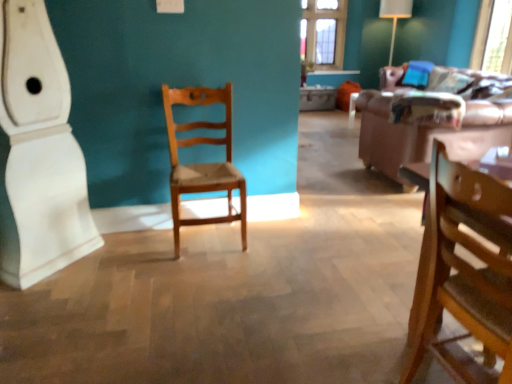
Describe the element at coordinates (203, 163) in the screenshot. The width and height of the screenshot is (512, 384). I see `natural wood chair at center, which is counted as the first chair, starting from the left` at that location.

The height and width of the screenshot is (384, 512). What are the coordinates of `brown leather couch at right` in the screenshot? It's located at (430, 114).

This screenshot has height=384, width=512. Describe the element at coordinates (430, 114) in the screenshot. I see `brown leather couch at right` at that location.

Identify the location of white glossy baseboard at left. (38, 153).

How different are the orientations of natural wood chair at center, marked as the second chair in a front-to-back arrangement, and wooden chair at right, which is the first chair from right to left, in degrees?

The angular difference between natural wood chair at center, marked as the second chair in a front-to-back arrangement, and wooden chair at right, which is the first chair from right to left, is 90.4 degrees.

Is point (177, 129) closer to camera compared to point (477, 270)?

No, (177, 129) is behind (477, 270).

At what (x,y) coordinates should I click in order to perform the action: click on chair that appears on the left of wooden chair at right, positioned as the 1th chair in front-to-back order. Please return your answer as a coordinate pair (x, y). Looking at the image, I should click on (203, 163).

Is natural wood chair at center, which is counted as the first chair, starting from the left, surrounding wooden chair at right, marked as the second chair in a back-to-front arrangement?

No, wooden chair at right, marked as the second chair in a back-to-front arrangement, is not surrounded by natural wood chair at center, which is counted as the first chair, starting from the left.

Would you say white glossy baseboard at left is part of transparent glass window screen at upper right's contents?

Actually, white glossy baseboard at left is outside transparent glass window screen at upper right.

Is transparent glass window screen at upper right oriented away from white glossy baseboard at left?

No, transparent glass window screen at upper right is not facing away from white glossy baseboard at left.

Does transparent glass window screen at upper right have a greater height compared to white glossy baseboard at left?

No.

How many degrees apart are the facing directions of transparent glass window screen at upper right and natural wood chair at center, marked as the second chair in a front-to-back arrangement?

They differ by 91 degrees in their facing directions.

Can you confirm if transparent glass window screen at upper right is bigger than natural wood chair at center, the 1th chair viewed from the back?

Actually, transparent glass window screen at upper right might be smaller than natural wood chair at center, the 1th chair viewed from the back.

From the picture: Is transparent glass window screen at upper right inside the boundaries of natural wood chair at center, the 1th chair viewed from the back, or outside?

transparent glass window screen at upper right is not inside natural wood chair at center, the 1th chair viewed from the back, it's outside.

Considering the points (490, 57) and (230, 206), which point is in front, point (490, 57) or point (230, 206)?

The point (230, 206) is closer.

Which point is more distant from viewer, (175, 181) or (475, 137)?

The point (475, 137) is more distant.

In the scene shown: Who is shorter, natural wood chair at center, the 1th chair viewed from the back, or brown leather couch at right?

With less height is brown leather couch at right.

Is natural wood chair at center, marked as the second chair in a front-to-back arrangement, oriented away from brown leather couch at right?

No, brown leather couch at right is not at the back of natural wood chair at center, marked as the second chair in a front-to-back arrangement.

Considering the sizes of objects natural wood chair at center, which is the 2th chair in right-to-left order, and brown leather couch at right in the image provided, who is bigger, natural wood chair at center, which is the 2th chair in right-to-left order, or brown leather couch at right?

With larger size is brown leather couch at right.

Is point (17, 140) farther from camera compared to point (489, 123)?

No, it is in front of (489, 123).

Is the depth of white glossy baseboard at left less than that of brown leather couch at right?

Yes.

In terms of size, does white glossy baseboard at left appear bigger or smaller than brown leather couch at right?

white glossy baseboard at left is smaller than brown leather couch at right.

From a real-world perspective, between white glossy baseboard at left and brown leather couch at right, who is vertically lower?

In real-world perspective, brown leather couch at right is lower.

From their relative heights in the image, would you say wooden chair at right, marked as the second chair in a back-to-front arrangement, is taller or shorter than white glossy baseboard at left?

Clearly, wooden chair at right, marked as the second chair in a back-to-front arrangement, is shorter compared to white glossy baseboard at left.

Where is `wide located above the wooden chair at right, positioned as the 1th chair in front-to-back order (from the image's perspective)`? The image size is (512, 384). wide located above the wooden chair at right, positioned as the 1th chair in front-to-back order (from the image's perspective) is located at coordinates (38, 153).

Can we say wooden chair at right, marked as the second chair in a back-to-front arrangement, lies outside white glossy baseboard at left?

wooden chair at right, marked as the second chair in a back-to-front arrangement, lies outside white glossy baseboard at left's area.

Does natural wood chair at center, which is the 2th chair in right-to-left order, have a lesser height compared to white glossy baseboard at left?

Correct, natural wood chair at center, which is the 2th chair in right-to-left order, is not as tall as white glossy baseboard at left.

Is natural wood chair at center, which is counted as the first chair, starting from the left, looking in the opposite direction of white glossy baseboard at left?

No, natural wood chair at center, which is counted as the first chair, starting from the left,'s orientation is not away from white glossy baseboard at left.

Is natural wood chair at center, which is counted as the first chair, starting from the left, at the right side of white glossy baseboard at left?

Yes, natural wood chair at center, which is counted as the first chair, starting from the left, is to the right of white glossy baseboard at left.

From the image's perspective, between natural wood chair at center, which is counted as the first chair, starting from the left, and white glossy baseboard at left, which one is located above?

white glossy baseboard at left, from the image's perspective.

I want to click on chair on the left of wooden chair at right, marked as the second chair in a back-to-front arrangement, so click(x=203, y=163).

You are a GUI agent. You are given a task and a screenshot of the screen. Output one action in this format:
    pyautogui.click(x=<x>, y=<y>)
    Task: Click on the wide in front of the transparent glass window screen at upper right
    The width and height of the screenshot is (512, 384).
    Given the screenshot: What is the action you would take?
    pyautogui.click(x=38, y=153)

Based on their spatial positions, is natural wood chair at center, which is the 2th chair in right-to-left order, or brown leather couch at right closer to white glossy baseboard at left?

The object closer to white glossy baseboard at left is natural wood chair at center, which is the 2th chair in right-to-left order.

When comparing their distances from brown leather couch at right, does white glossy baseboard at left or wooden chair at right, which is the first chair from right to left, seem further?

white glossy baseboard at left is positioned further to the anchor brown leather couch at right.

From the image, which object appears to be nearer to white glossy baseboard at left, transparent glass window screen at upper right or brown leather couch at right?

brown leather couch at right lies closer to white glossy baseboard at left than the other object.

From the picture: Based on their spatial positions, is transparent glass window screen at upper right or white glossy baseboard at left closer to wooden chair at right, positioned as the 1th chair in front-to-back order?

white glossy baseboard at left lies closer to wooden chair at right, positioned as the 1th chair in front-to-back order, than the other object.

Estimate the real-world distances between objects in this image. Which object is further from transparent glass window screen at upper right, white glossy baseboard at left or wooden chair at right, marked as the second chair in a back-to-front arrangement?

white glossy baseboard at left is further to transparent glass window screen at upper right.

When comparing their distances from transparent glass window screen at upper right, does natural wood chair at center, marked as the second chair in a front-to-back arrangement, or white glossy baseboard at left seem closer?

natural wood chair at center, marked as the second chair in a front-to-back arrangement, is closer to transparent glass window screen at upper right.

Estimate the real-world distances between objects in this image. Which object is further from transparent glass window screen at upper right, wooden chair at right, positioned as the 1th chair in front-to-back order, or natural wood chair at center, the 1th chair viewed from the back?

wooden chair at right, positioned as the 1th chair in front-to-back order, is positioned further to the anchor transparent glass window screen at upper right.

From the image, which object appears to be nearer to brown leather couch at right, white glossy baseboard at left or transparent glass window screen at upper right?

transparent glass window screen at upper right lies closer to brown leather couch at right than the other object.

Find the location of `studio couch between natural wood chair at center, marked as the second chair in a front-to-back arrangement, and transparent glass window screen at upper right, in the horizontal direction`. studio couch between natural wood chair at center, marked as the second chair in a front-to-back arrangement, and transparent glass window screen at upper right, in the horizontal direction is located at coordinates (430, 114).

Locate an element on the screen. This screenshot has width=512, height=384. studio couch between white glossy baseboard at left and transparent glass window screen at upper right in the horizontal direction is located at coordinates (430, 114).

You are a GUI agent. You are given a task and a screenshot of the screen. Output one action in this format:
    pyautogui.click(x=<x>, y=<y>)
    Task: Click on the studio couch between wooden chair at right, which is the first chair from right to left, and transparent glass window screen at upper right from front to back
    The width and height of the screenshot is (512, 384).
    Given the screenshot: What is the action you would take?
    pyautogui.click(x=430, y=114)

I want to click on chair positioned between wooden chair at right, which is the first chair from right to left, and transparent glass window screen at upper right from near to far, so click(x=203, y=163).